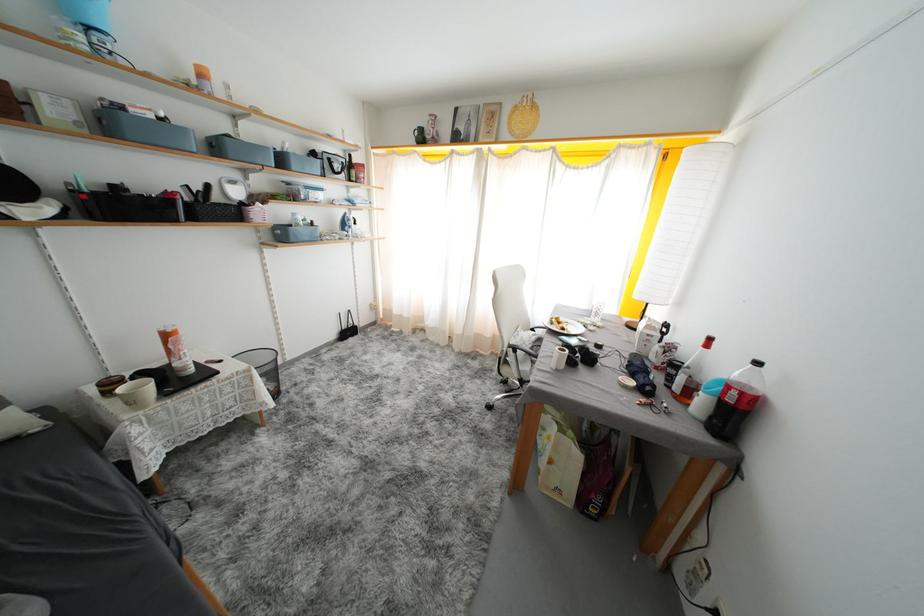
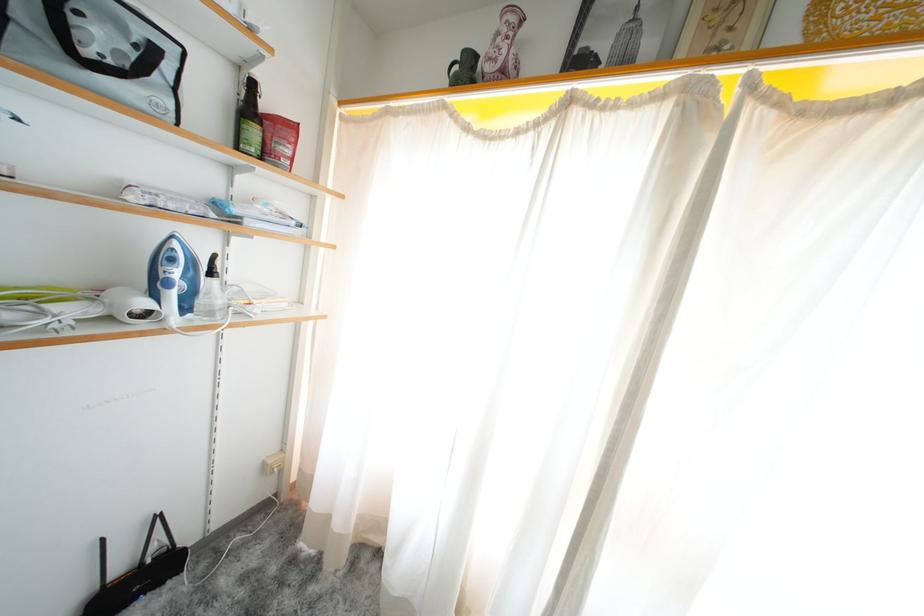
Where in the second image is the point corresponding to (x=390, y=313) from the first image?

(306, 475)